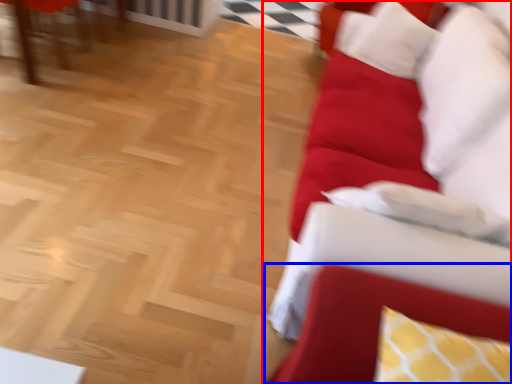
Question: Which of the following is the farthest to the observer, studio couch (highlighted by a red box) or swivel chair (highlighted by a blue box)?

Choices:
 (A) studio couch
 (B) swivel chair

Answer: (A)